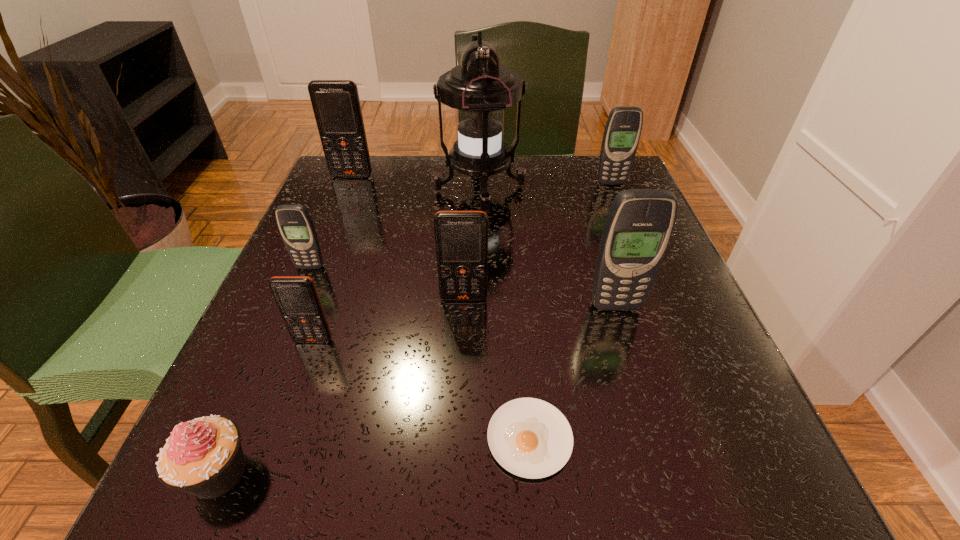
At what (x,y) coordinates should I click in order to perform the action: click on vacant space situated 0.120m on the screen of the farthest gray cellular telephone. Please return your answer as a coordinate pair (x, y). Looking at the image, I should click on (624, 215).

The image size is (960, 540). Identify the location of free region located on the screen of the rightmost orange cellular telephone. (460, 408).

Find the location of `vacant point located on the screen of the smallest orange cellular telephone`. vacant point located on the screen of the smallest orange cellular telephone is located at coordinates pyautogui.click(x=299, y=383).

You are a GUI agent. You are given a task and a screenshot of the screen. Output one action in this format:
    pyautogui.click(x=<x>, y=<y>)
    Task: Click on the vacant space located 0.240m on the screen of the fourth nearest cellular telephone
    This screenshot has height=540, width=960.
    Given the screenshot: What is the action you would take?
    pyautogui.click(x=262, y=380)

Identify the location of free space located 0.350m on the right of the second shortest object. The width and height of the screenshot is (960, 540). (539, 472).

In order to click on free space located 0.360m on the left of the shortest object in this screenshot , I will do `click(212, 438)`.

You are a GUI agent. You are given a task and a screenshot of the screen. Output one action in this format:
    pyautogui.click(x=<x>, y=<y>)
    Task: Click on the lantern that is at the far edge
    This screenshot has width=960, height=540.
    Given the screenshot: What is the action you would take?
    pyautogui.click(x=479, y=89)

Locate an element on the screen. The height and width of the screenshot is (540, 960). cupcake located in the near edge section of the desktop is located at coordinates (204, 457).

Locate an element on the screen. egg yolk that is at the near edge is located at coordinates (530, 438).

Locate an element on the screen. cupcake that is positioned at the left edge is located at coordinates (204, 457).